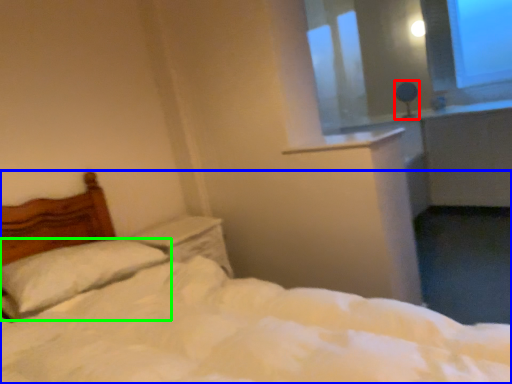
Question: Considering the real-world distances, which object is closest to table lamp (highlighted by a red box)? bed (highlighted by a blue box) or pillow (highlighted by a green box).

Choices:
 (A) bed
 (B) pillow

Answer: (B)